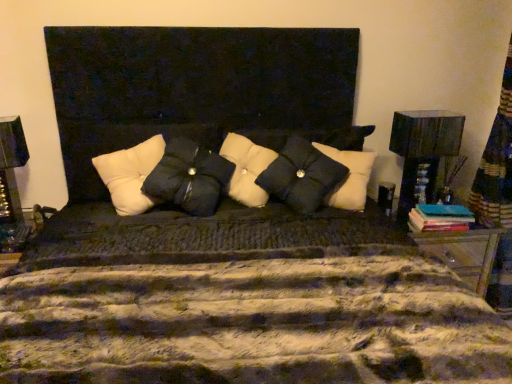
Question: Is black matte pillow at center, which is the second pillow in right-to-left order, to the left of black textured pillow at center, marked as the 3th pillow in a left-to-right arrangement, from the viewer's perspective?

Choices:
 (A) no
 (B) yes

Answer: (B)

Question: Would you say black matte pillow at center, placed as the second pillow when sorted from left to right, is a long distance from black textured pillow at center, marked as the 3th pillow in a left-to-right arrangement?

Choices:
 (A) yes
 (B) no

Answer: (B)

Question: From a real-world perspective, is black matte pillow at center, which is the second pillow in right-to-left order, below black textured pillow at center, marked as the 3th pillow in a left-to-right arrangement?

Choices:
 (A) no
 (B) yes

Answer: (A)

Question: Is black matte pillow at center, which is the second pillow in right-to-left order, not inside black textured pillow at center, the first pillow positioned from the right?

Choices:
 (A) no
 (B) yes

Answer: (B)

Question: Is the depth of black matte pillow at center, which is the second pillow in right-to-left order, greater than that of black textured pillow at center, the first pillow positioned from the right?

Choices:
 (A) no
 (B) yes

Answer: (A)

Question: Is black textured pillow at center, marked as the 3th pillow in a left-to-right arrangement, bigger or smaller than matte black lampshade at right?

Choices:
 (A) small
 (B) big

Answer: (B)

Question: Considering the relative positions of black textured pillow at center, the first pillow positioned from the right, and matte black lampshade at right in the image provided, is black textured pillow at center, the first pillow positioned from the right, to the left or to the right of matte black lampshade at right?

Choices:
 (A) left
 (B) right

Answer: (A)

Question: Is black textured pillow at center, the first pillow positioned from the right, in front of or behind matte black lampshade at right in the image?

Choices:
 (A) front
 (B) behind

Answer: (A)

Question: Would you say black textured pillow at center, the first pillow positioned from the right, is inside or outside matte black lampshade at right?

Choices:
 (A) outside
 (B) inside

Answer: (A)

Question: Is point (209, 182) positioned closer to the camera than point (302, 210)?

Choices:
 (A) farther
 (B) closer

Answer: (B)

Question: Visually, is black matte pillow at center, which is the second pillow in right-to-left order, positioned to the left or to the right of black textured pillow at center, marked as the 3th pillow in a left-to-right arrangement?

Choices:
 (A) left
 (B) right

Answer: (A)

Question: Looking at their shapes, would you say black matte pillow at center, which is the second pillow in right-to-left order, is wider or thinner than black textured pillow at center, marked as the 3th pillow in a left-to-right arrangement?

Choices:
 (A) thin
 (B) wide

Answer: (B)

Question: Considering the positions of black matte pillow at center, which is the second pillow in right-to-left order, and black textured pillow at center, marked as the 3th pillow in a left-to-right arrangement, in the image, is black matte pillow at center, which is the second pillow in right-to-left order, bigger or smaller than black textured pillow at center, marked as the 3th pillow in a left-to-right arrangement,?

Choices:
 (A) big
 (B) small

Answer: (A)

Question: Does point (158, 134) appear closer or farther from the camera than point (307, 213)?

Choices:
 (A) farther
 (B) closer

Answer: (A)

Question: From a real-world perspective, is white tufted pillow at center, positioned as the 1th pillow in left-to-right order, positioned above or below black textured pillow at center, marked as the 3th pillow in a left-to-right arrangement?

Choices:
 (A) below
 (B) above

Answer: (A)